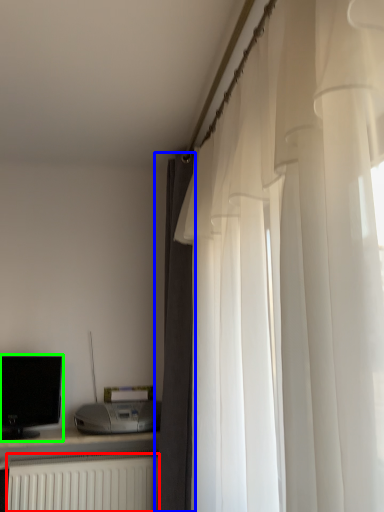
Question: Which object is positioned closest to radiator (highlighted by a red box)? Select from curtain (highlighted by a blue box) and computer monitor (highlighted by a green box).

Choices:
 (A) curtain
 (B) computer monitor

Answer: (B)